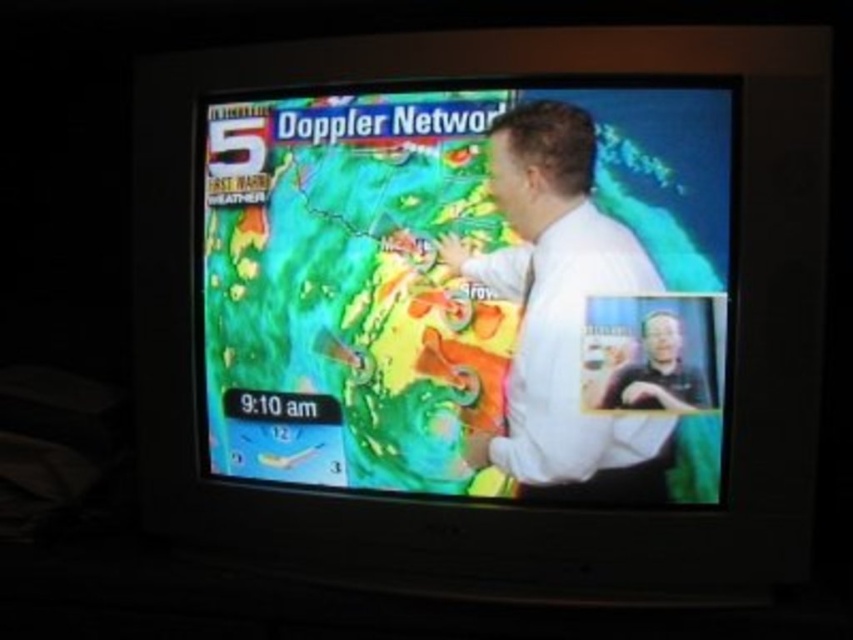
You are a weather analyst observing the Doppler radar map on the television screen. You notice two points marked on the radar map at coordinates point (338, 454) and point (546, 474). Which point is closer to the camera?

Point (546, 474) is closer to the camera than point (338, 454) because the description states that point (338, 454) is further away.